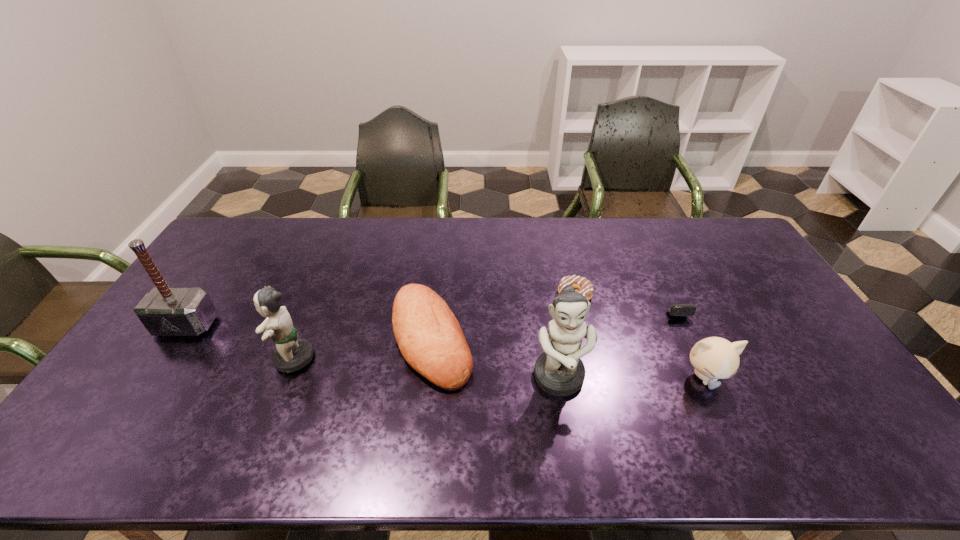
Where is `vacant region between the shortest object and the webcam`? The height and width of the screenshot is (540, 960). vacant region between the shortest object and the webcam is located at coordinates (620, 295).

You are a GUI agent. You are given a task and a screenshot of the screen. Output one action in this format:
    pyautogui.click(x=<x>, y=<y>)
    Task: Click on the free point between the taller figurine and the webcam
    Image resolution: width=960 pixels, height=540 pixels.
    Given the screenshot: What is the action you would take?
    pyautogui.click(x=612, y=337)

Where is `vacant region between the webcam and the taller figurine`? The image size is (960, 540). vacant region between the webcam and the taller figurine is located at coordinates pyautogui.click(x=612, y=337).

Locate an element on the screen. free area in between the sixth object from right to left and the bread is located at coordinates (362, 349).

Locate an element on the screen. Image resolution: width=960 pixels, height=540 pixels. vacant region between the fourth tallest object and the right figurine is located at coordinates (633, 377).

Find the location of a particular element. The width and height of the screenshot is (960, 540). vacant space that is in between the left figurine and the leftmost object is located at coordinates (239, 342).

Image resolution: width=960 pixels, height=540 pixels. I want to click on the fifth closest object to the leftmost object, so click(x=713, y=358).

Select which object is the closest to the shortest object. Please provide its 2D coordinates. Your answer should be formatted as a tuple, i.e. [(x, y)], where the tuple contains the x and y coordinates of a point satisfying the conditions above.

[(679, 309)]

This screenshot has width=960, height=540. Find the location of `vacant region that satisfies the following two spatial constraints: 1. on the back side of the third object from left to right; 2. on the right side of the shortest object`. vacant region that satisfies the following two spatial constraints: 1. on the back side of the third object from left to right; 2. on the right side of the shortest object is located at coordinates (437, 294).